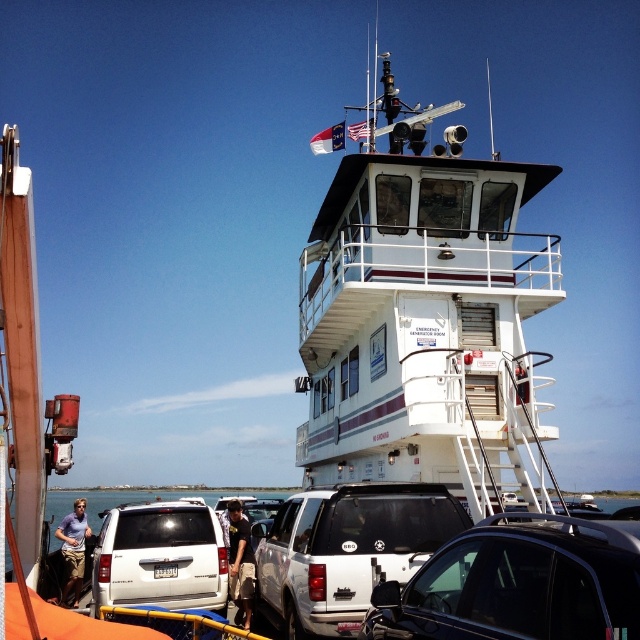
Which is more to the left, metallic silver suv at center or dark brown leather jacket at center?

From the viewer's perspective, dark brown leather jacket at center appears more on the left side.

Is metallic silver suv at center further to the viewer compared to dark brown leather jacket at center?

No, it is in front of dark brown leather jacket at center.

Who is more forward, (502, 561) or (234, 528)?

Point (502, 561)

Identify the location of metallic silver suv at center. This screenshot has width=640, height=640. (516, 586).

Describe the element at coordinates (346, 550) in the screenshot. I see `white matte suv at center` at that location.

Which is more to the left, white matte suv at center or dark brown leather jacket at center?

dark brown leather jacket at center is more to the left.

The image size is (640, 640). Describe the element at coordinates (346, 550) in the screenshot. I see `white matte suv at center` at that location.

This screenshot has width=640, height=640. In order to click on white matte suv at center in this screenshot , I will do `click(346, 550)`.

Which is in front, point (460, 609) or point (314, 508)?

Point (460, 609)

Can you confirm if metallic silver suv at center is thinner than white matte suv at center?

Incorrect, metallic silver suv at center's width is not less than white matte suv at center's.

Between point (481, 621) and point (304, 513), which one is positioned in front?

Point (481, 621) is in front.

Where is `metallic silver suv at center`? This screenshot has width=640, height=640. metallic silver suv at center is located at coordinates (516, 586).